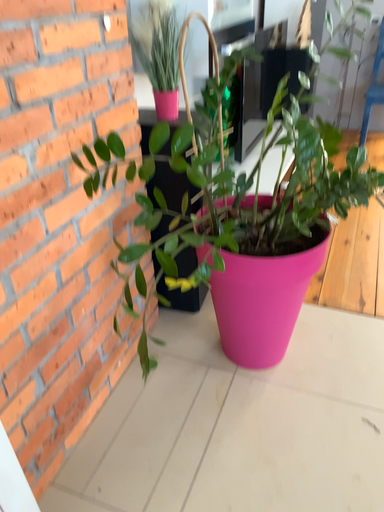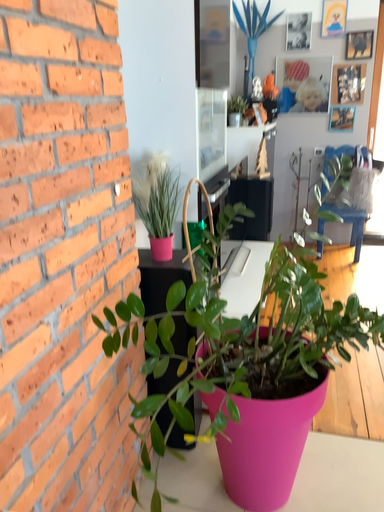
Question: How did the camera likely rotate when shooting the video?

Choices:
 (A) rotated downward
 (B) rotated upward

Answer: (B)